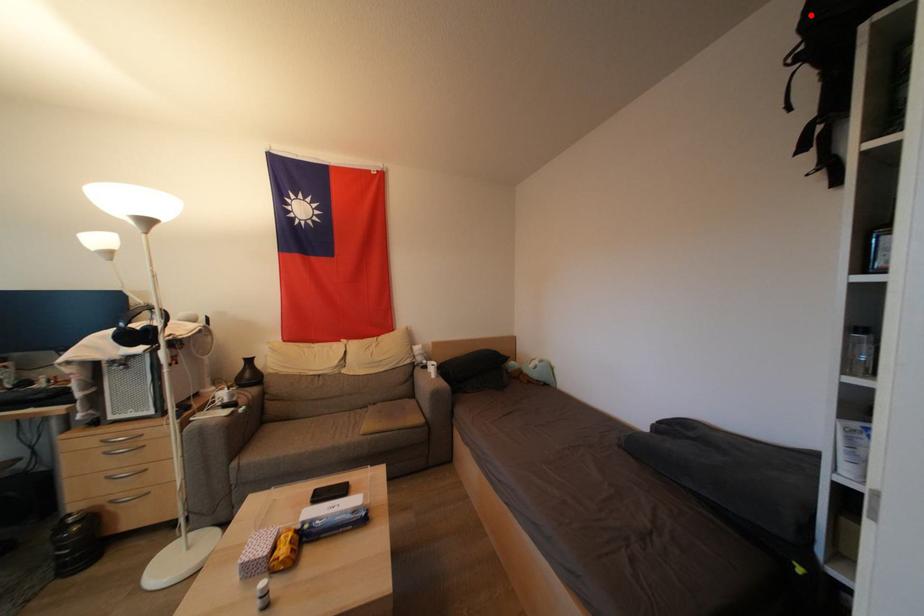
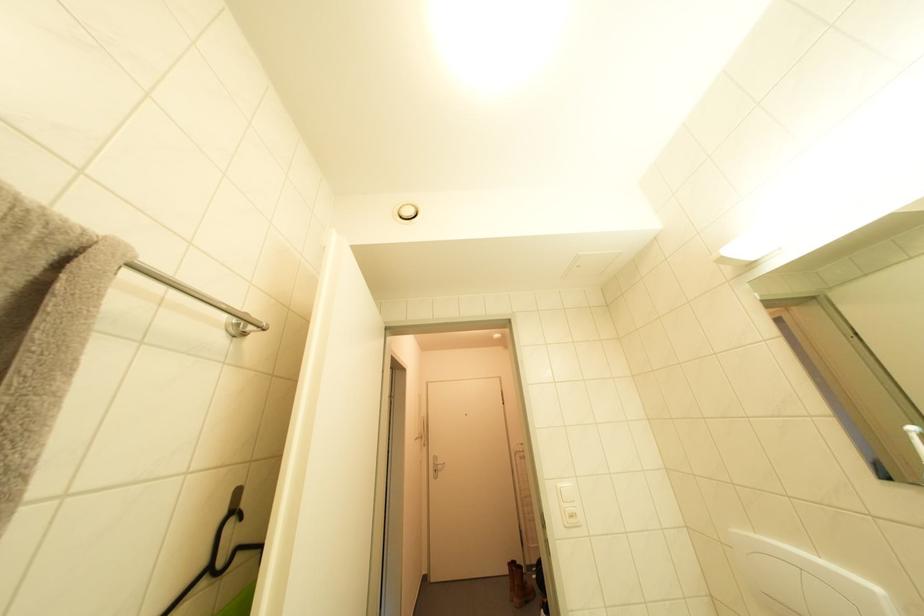
Question: I am providing you with two images of the same scene from different viewpoints. A red point is marked on the first image. Is the red point's position out of view in image 2?

Choices:
 (A) Yes
 (B) No

Answer: (A)